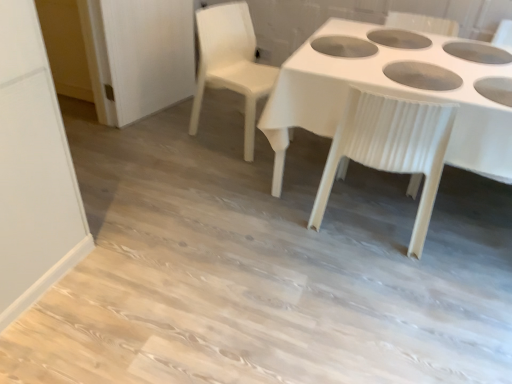
Question: Considering the relative sizes of white plastic chair at center, the second chair positioned from the left, and white plastic table at center in the image provided, is white plastic chair at center, the second chair positioned from the left, wider than white plastic table at center?

Choices:
 (A) yes
 (B) no

Answer: (B)

Question: Is white plastic chair at center, the second chair positioned from the left, next to white plastic table at center and touching it?

Choices:
 (A) yes
 (B) no

Answer: (B)

Question: Does white plastic chair at center, the second chair positioned from the left, turn towards white plastic table at center?

Choices:
 (A) no
 (B) yes

Answer: (B)

Question: Is white plastic chair at center, the second chair positioned from the left, not within white plastic table at center?

Choices:
 (A) yes
 (B) no

Answer: (B)

Question: Is white plastic chair at center, the second chair positioned from the left, not close to white plastic table at center?

Choices:
 (A) no
 (B) yes

Answer: (A)

Question: In the image, is white plastic table at center on the left side or the right side of white plastic chair at upper center, positioned as the second chair in right-to-left order?

Choices:
 (A) left
 (B) right

Answer: (B)

Question: Is white plastic table at center bigger or smaller than white plastic chair at upper center, positioned as the second chair in right-to-left order?

Choices:
 (A) small
 (B) big

Answer: (B)

Question: Choose the correct answer: Is white plastic table at center inside white plastic chair at upper center, the first chair from the left, or outside it?

Choices:
 (A) outside
 (B) inside

Answer: (A)

Question: Considering their positions, is white plastic table at center located in front of or behind white plastic chair at upper center, positioned as the second chair in right-to-left order?

Choices:
 (A) front
 (B) behind

Answer: (A)

Question: Based on their sizes in the image, would you say white plastic table at center is bigger or smaller than white plastic chair at center, the second chair positioned from the left?

Choices:
 (A) big
 (B) small

Answer: (A)

Question: Considering the relative positions of white plastic table at center and white plastic chair at center, arranged as the 1th chair when viewed from the right, in the image provided, is white plastic table at center to the left or to the right of white plastic chair at center, arranged as the 1th chair when viewed from the right,?

Choices:
 (A) right
 (B) left

Answer: (A)

Question: Choose the correct answer: Is white plastic table at center inside white plastic chair at center, the second chair positioned from the left, or outside it?

Choices:
 (A) inside
 (B) outside

Answer: (B)

Question: Is white plastic table at center taller or shorter than white plastic chair at center, the second chair positioned from the left?

Choices:
 (A) short
 (B) tall

Answer: (A)

Question: Considering the positions of white plastic chair at center, arranged as the 1th chair when viewed from the right, and white plastic table at center in the image, is white plastic chair at center, arranged as the 1th chair when viewed from the right, taller or shorter than white plastic table at center?

Choices:
 (A) short
 (B) tall

Answer: (B)

Question: Considering the positions of white plastic chair at center, the second chair positioned from the left, and white plastic table at center in the image, is white plastic chair at center, the second chair positioned from the left, bigger or smaller than white plastic table at center?

Choices:
 (A) small
 (B) big

Answer: (A)